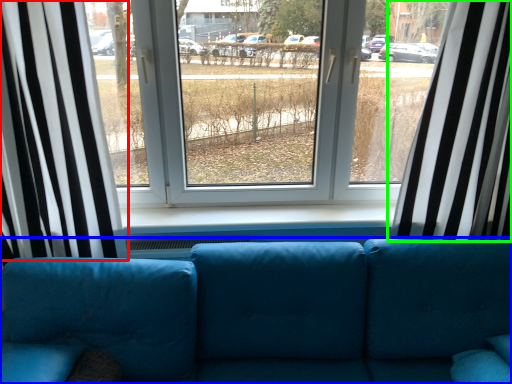
Question: Considering the real-world distances, which object is farthest from curtain (highlighted by a red box)? studio couch (highlighted by a blue box) or curtain (highlighted by a green box)?

Choices:
 (A) studio couch
 (B) curtain

Answer: (B)